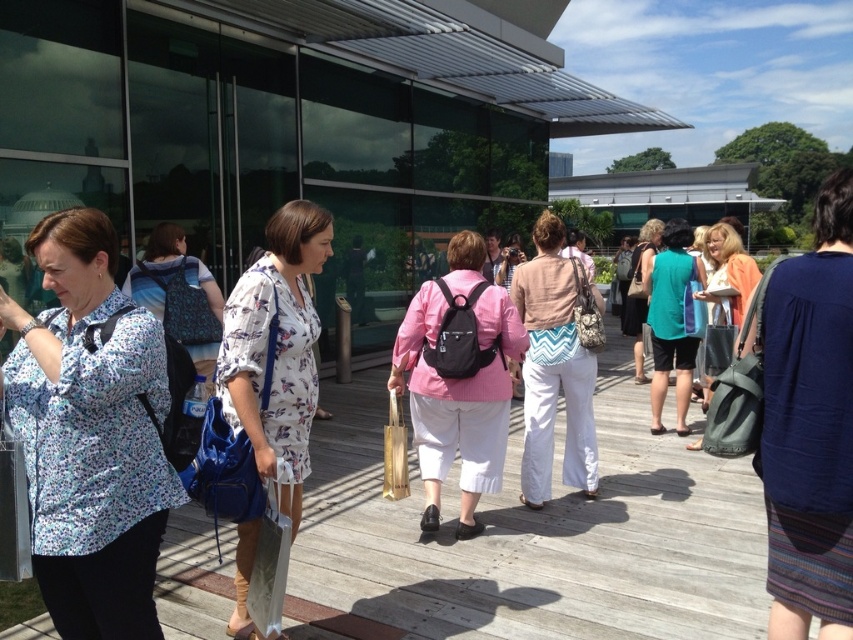
Is pink matte backpack at center behind white floral dress at center?

That is True.

Measure the distance between pink matte backpack at center and camera.

A distance of 3.88 meters exists between pink matte backpack at center and camera.

At what (x,y) coordinates should I click in order to perform the action: click on pink matte backpack at center. Please return your answer as a coordinate pair (x, y). The image size is (853, 640). Looking at the image, I should click on (457, 378).

Which is behind, point (292, 429) or point (737, 298)?

Positioned behind is point (737, 298).

From the picture: Can you confirm if white floral dress at center is wider than matte gray tote bag at center right?

In fact, white floral dress at center might be narrower than matte gray tote bag at center right.

Find the location of `white floral dress at center`. white floral dress at center is located at coordinates (276, 346).

Can you confirm if white floral dress at center is wider than chevron-patterned bag at center?

No, white floral dress at center is not wider than chevron-patterned bag at center.

What do you see at coordinates (276, 346) in the screenshot? Image resolution: width=853 pixels, height=640 pixels. I see `white floral dress at center` at bounding box center [276, 346].

Is point (312, 362) positioned before point (579, 406)?

Yes, it is in front of point (579, 406).

Locate an element on the screen. white floral dress at center is located at coordinates (276, 346).